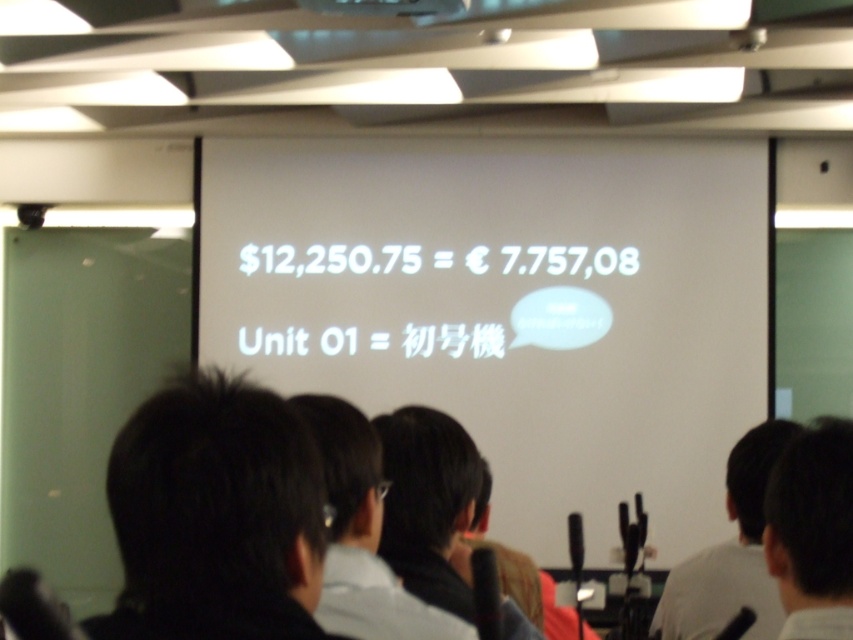
Question: Can you confirm if dark hair at center is thinner than black shirt at center?

Choices:
 (A) yes
 (B) no

Answer: (B)

Question: Can you confirm if dark hair at center is positioned below dark hair at upper right?

Choices:
 (A) yes
 (B) no

Answer: (A)

Question: Among these points, which one is farthest from the camera?

Choices:
 (A) (196, 595)
 (B) (766, 522)
 (C) (721, 346)
 (D) (776, 586)

Answer: (C)

Question: Which of these objects is positioned farthest from the black hair at left?

Choices:
 (A) black shirt at center
 (B) dark hair at center
 (C) white shirt at right
 (D) dark hair at upper right

Answer: (C)

Question: Among these points, which one is nearest to the camera?

Choices:
 (A) (653, 625)
 (B) (438, 589)
 (C) (392, 12)

Answer: (B)

Question: In this image, where is white shirt at right located relative to matte white projector at upper center?

Choices:
 (A) left
 (B) right

Answer: (B)